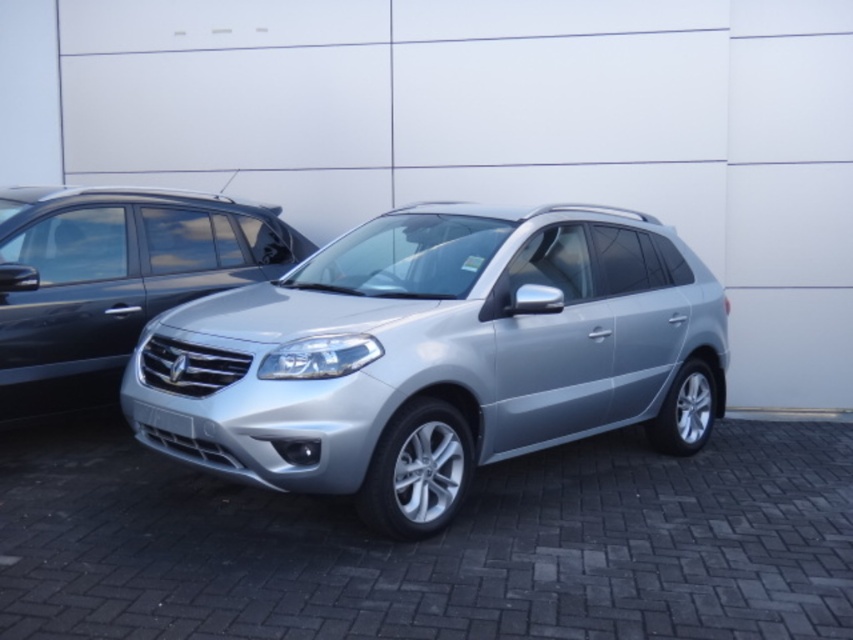
Does satin silver suv at center have a smaller size compared to satin silver minivan at left?

Actually, satin silver suv at center might be larger than satin silver minivan at left.

Between satin silver suv at center and satin silver minivan at left, which one is positioned lower?

A: satin silver suv at center

Describe the element at coordinates (437, 355) in the screenshot. I see `satin silver suv at center` at that location.

The height and width of the screenshot is (640, 853). Identify the location of satin silver suv at center. (437, 355).